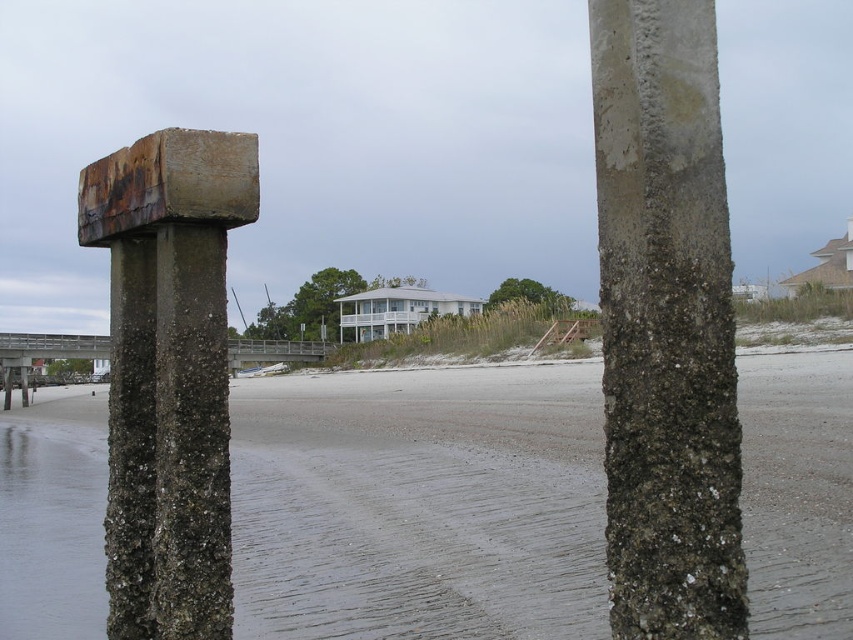
Question: Does rusty concrete post at center appear on the left side of brown wooden dock at center?

Choices:
 (A) no
 (B) yes

Answer: (B)

Question: Which object is the farthest from the rusty concrete post at left?

Choices:
 (A) rusty concrete post at center
 (B) sandy gray sand at center
 (C) clear water at lower left
 (D) brown wooden dock at center

Answer: (D)

Question: Does rusty concrete post at center have a greater width compared to clear water at lower left?

Choices:
 (A) yes
 (B) no

Answer: (B)

Question: Which is farther from the sandy gray sand at center?

Choices:
 (A) clear water at lower left
 (B) rusty concrete post at center
 (C) rusty concrete post at left
 (D) brown wooden dock at center

Answer: (D)

Question: Which object appears farthest from the camera in this image?

Choices:
 (A) rusty concrete post at center
 (B) rusty concrete post at left
 (C) brown wooden dock at center
 (D) sandy gray sand at center

Answer: (C)

Question: Can you confirm if rusty concrete post at left is positioned to the left of clear water at lower left?

Choices:
 (A) yes
 (B) no

Answer: (B)